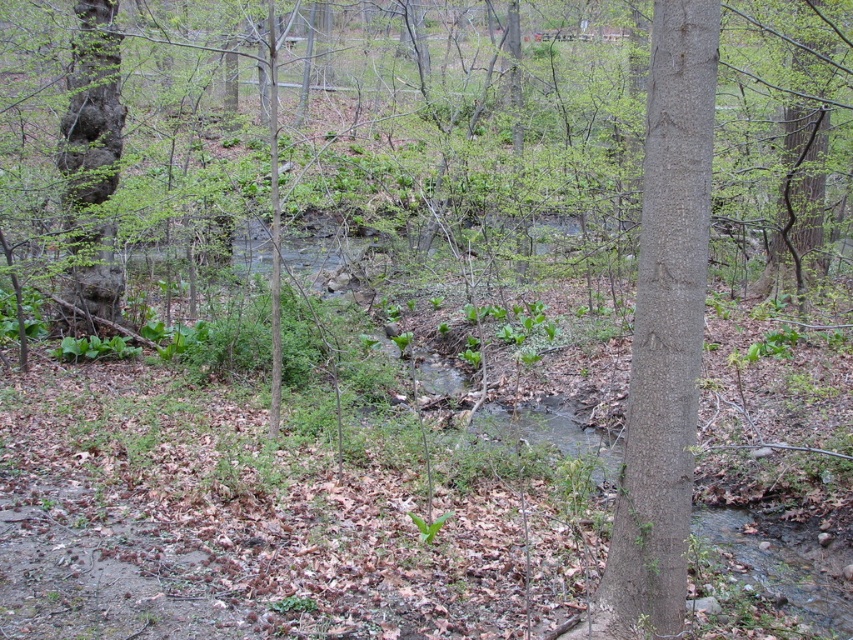
Question: Can you confirm if smooth brown tree trunk at center-right is wider than dark brown bark tree at left?

Choices:
 (A) no
 (B) yes

Answer: (A)

Question: Which point appears closest to the camera in this image?

Choices:
 (A) (672, 161)
 (B) (99, 92)

Answer: (A)

Question: Which object appears closest to the camera in this image?

Choices:
 (A) smooth brown tree trunk at center-right
 (B) dark brown bark tree at left

Answer: (A)

Question: Does smooth brown tree trunk at center-right appear over dark brown bark tree at left?

Choices:
 (A) no
 (B) yes

Answer: (A)

Question: Is smooth brown tree trunk at center-right above dark brown bark tree at left?

Choices:
 (A) no
 (B) yes

Answer: (A)

Question: Which point appears farthest from the camera in this image?

Choices:
 (A) (106, 248)
 (B) (680, 3)

Answer: (A)